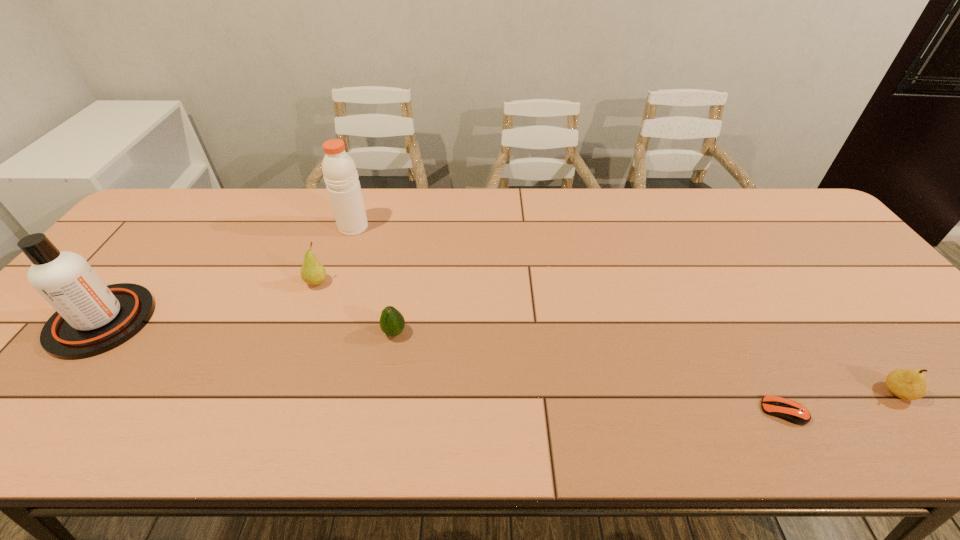
At what (x,y) coordinates should I click in order to perform the action: click on the farthest object. Please return your answer as a coordinate pair (x, y). Looking at the image, I should click on (339, 170).

Locate an element on the screen. This screenshot has width=960, height=540. the leftmost object is located at coordinates (91, 318).

Locate an element on the screen. the taller pear is located at coordinates (312, 272).

Identify the location of the farther pear. (312, 272).

I want to click on the rightmost object, so click(906, 384).

Find the location of a particular element. The image size is (960, 540). the nearer pear is located at coordinates (906, 384).

The width and height of the screenshot is (960, 540). Find the location of `the third object from right to left`. the third object from right to left is located at coordinates (392, 323).

What are the coordinates of `computer mouse` in the screenshot? It's located at (788, 410).

Where is `the second object from right to left`? the second object from right to left is located at coordinates (788, 410).

Locate an element on the screen. The width and height of the screenshot is (960, 540). free space located on the left of the shaker is located at coordinates (x=271, y=227).